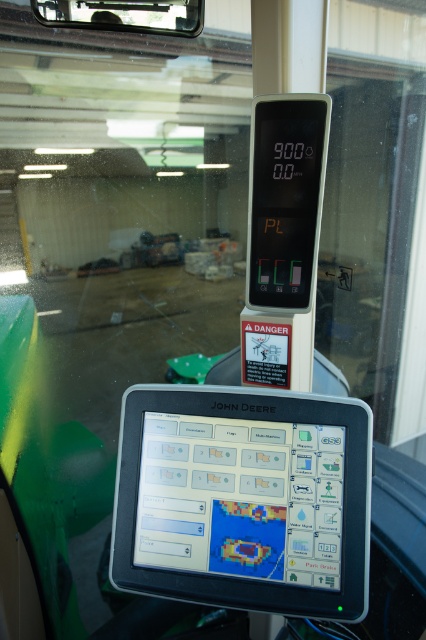
You are operating a John Deere tractor and need to adjust settings on both the black plastic tablet computer at center and the black plastic display at upper center. Which device should you reach for first if you want to make adjustments without moving your hands too far from your current position, assuming your hands are near the steering wheel?

You should adjust the black plastic tablet computer at center first because it is located to the left of the black plastic display at upper center, making it closer to your hands near the steering wheel.

Looking at this image, you are operating a John Deere tractor and need to adjust the settings on the black plastic tablet computer at center. The touchscreen display labeled John Deere is directly above it. How far apart are the two screens?

The two screens are 29.34 inches apart.